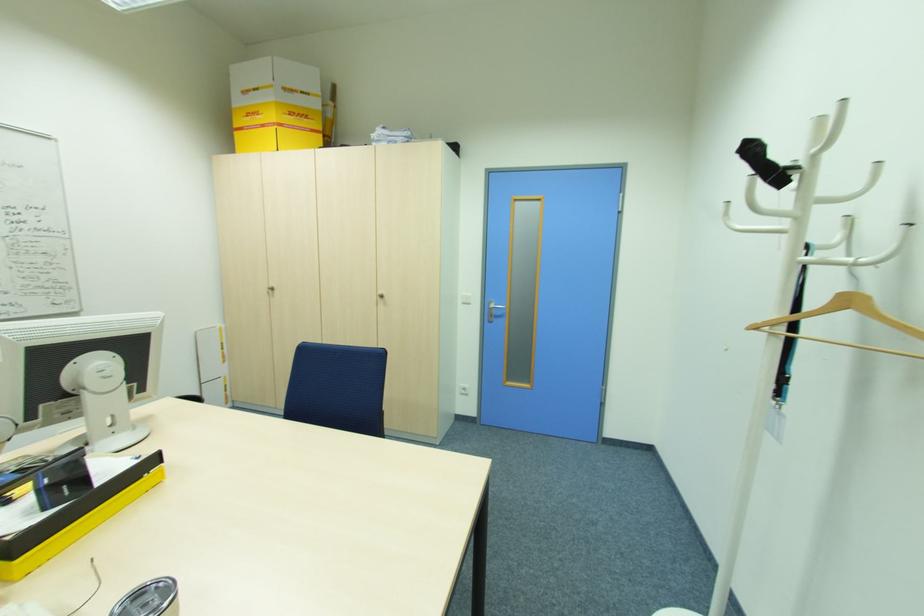
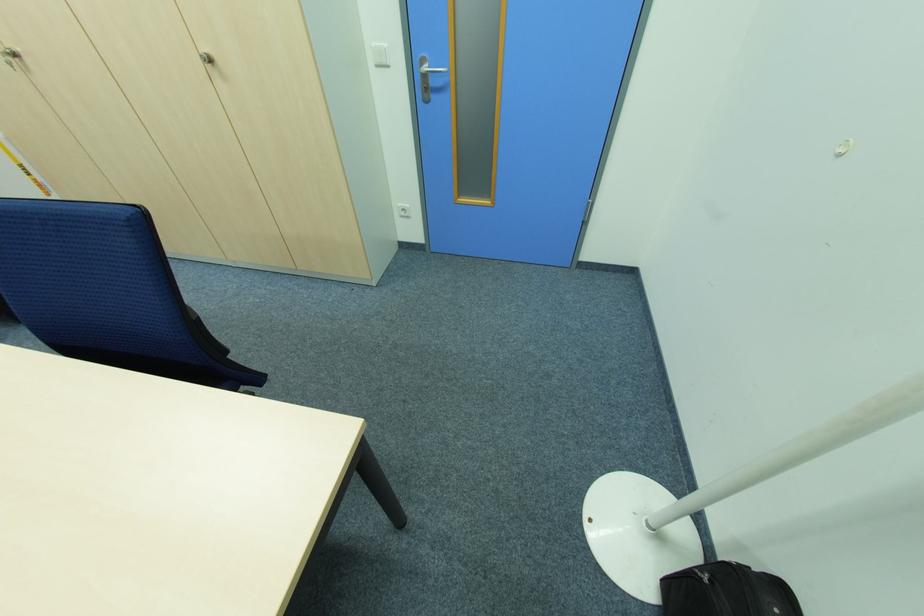
Where in the second image is the point corresponding to point 274,290 from the first image?

(18, 55)